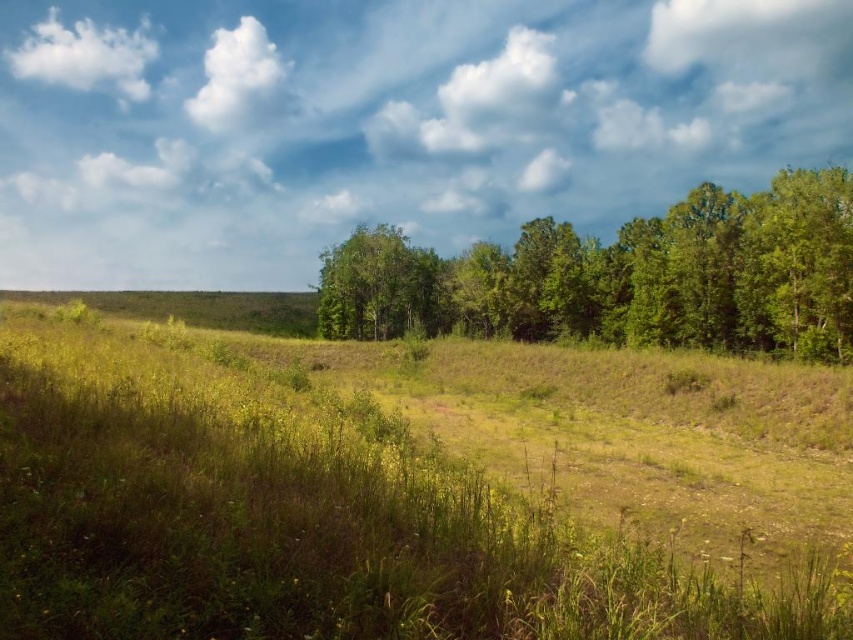
Image resolution: width=853 pixels, height=640 pixels. I want to click on green leafy tree at center, so click(376, 285).

Is green leafy tree at center to the left of white fluffy cloud at upper center from the viewer's perspective?

No, green leafy tree at center is not to the left of white fluffy cloud at upper center.

Does point (405, 243) come in front of point (228, 97)?

Yes.

Find the location of a particular element. green leafy tree at center is located at coordinates (376, 285).

Based on the photo, can you confirm if green leafy trees at center is bigger than white fluffy cloud at upper center?

Correct, green leafy trees at center is larger in size than white fluffy cloud at upper center.

Is green leafy trees at center behind white fluffy cloud at upper center?

No, green leafy trees at center is in front of white fluffy cloud at upper center.

At what (x,y) coordinates should I click in order to perform the action: click on green leafy trees at center. Please return your answer as a coordinate pair (x, y). Looking at the image, I should click on (624, 276).

Image resolution: width=853 pixels, height=640 pixels. In order to click on green leafy trees at center in this screenshot , I will do `click(624, 276)`.

From the picture: Can you confirm if green leafy trees at center is wider than green leafy tree at center?

Correct, the width of green leafy trees at center exceeds that of green leafy tree at center.

This screenshot has height=640, width=853. What do you see at coordinates (624, 276) in the screenshot? I see `green leafy trees at center` at bounding box center [624, 276].

Between point (723, 253) and point (405, 268), which one is positioned behind?

Point (405, 268)

You are a GUI agent. You are given a task and a screenshot of the screen. Output one action in this format:
    pyautogui.click(x=<x>, y=<y>)
    Task: Click on the green leafy trees at center
    Image resolution: width=853 pixels, height=640 pixels.
    Given the screenshot: What is the action you would take?
    (x=624, y=276)